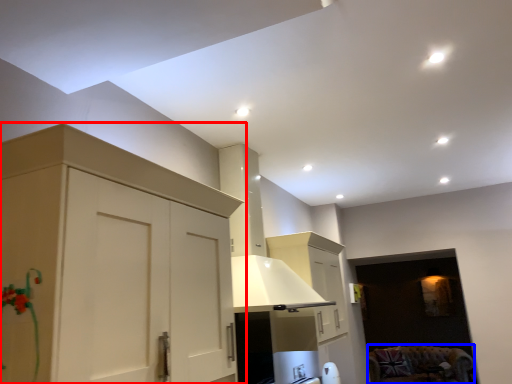
Question: Among these objects, which one is farthest to the camera, cabinetry (highlighted by a red box) or furniture (highlighted by a blue box)?

Choices:
 (A) cabinetry
 (B) furniture

Answer: (B)